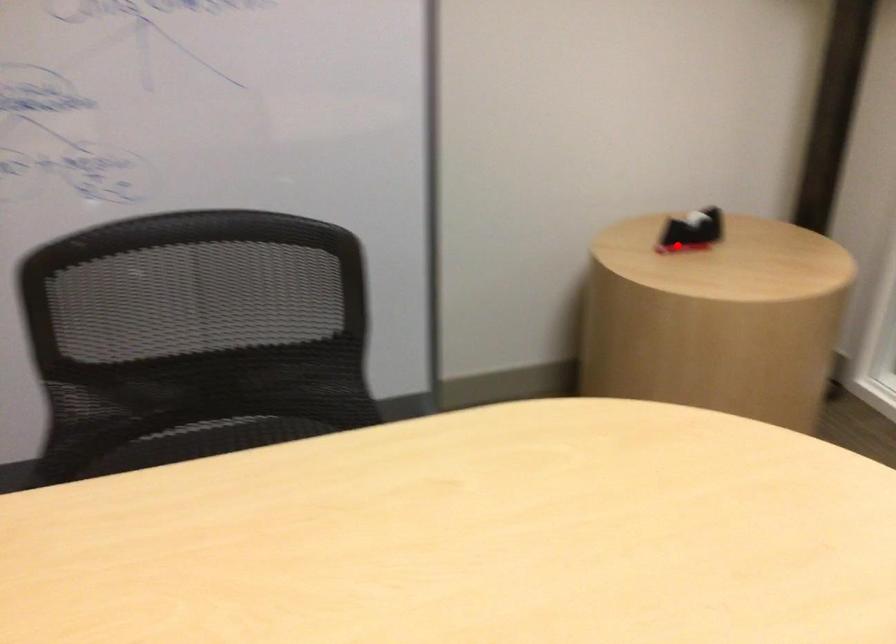
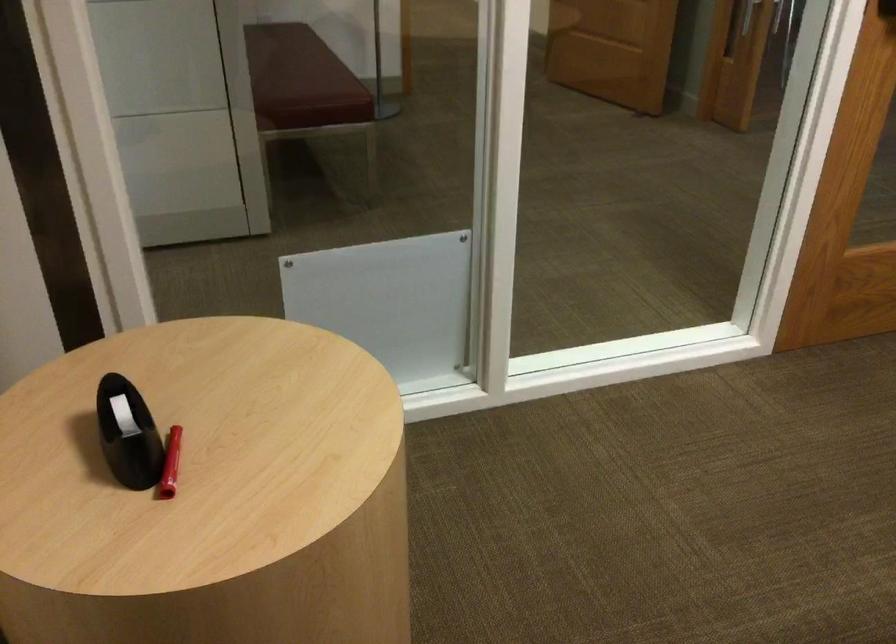
In the second image, find the point that corresponds to the highlighted location in the first image.

(170, 464)